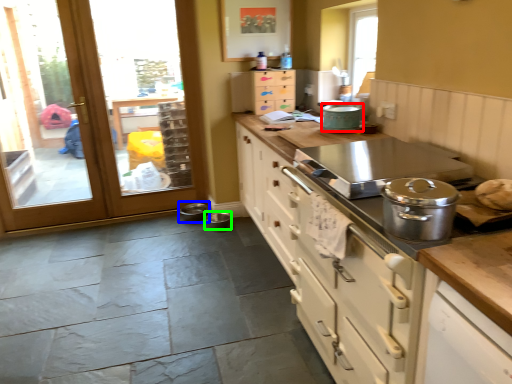
Question: Based on their relative distances, which object is farther from kitchen appliance (highlighted by a red box)? Choose from appliance (highlighted by a blue box) and appliance (highlighted by a green box).

Choices:
 (A) appliance
 (B) appliance

Answer: (A)